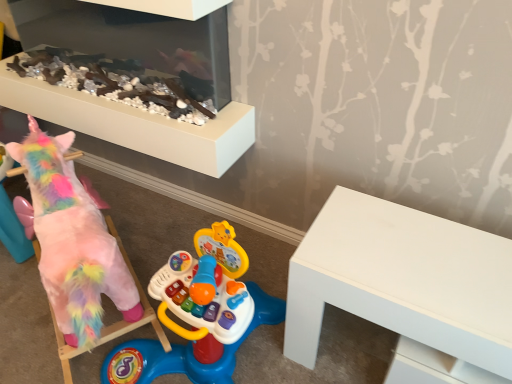
Question: Are smooth white fireplace at upper center and fluffy pink unicorn at left making contact?

Choices:
 (A) yes
 (B) no

Answer: (B)

Question: From a real-world perspective, is smooth white fireplace at upper center positioned under fluffy pink unicorn at left based on gravity?

Choices:
 (A) no
 (B) yes

Answer: (A)

Question: Does smooth white fireplace at upper center come behind fluffy pink unicorn at left?

Choices:
 (A) no
 (B) yes

Answer: (B)

Question: From the image's perspective, is smooth white fireplace at upper center beneath fluffy pink unicorn at left?

Choices:
 (A) no
 (B) yes

Answer: (A)

Question: From the image's perspective, is smooth white fireplace at upper center above fluffy pink unicorn at left?

Choices:
 (A) no
 (B) yes

Answer: (B)

Question: Based on their positions, is fluffy pink unicorn at left located to the left or right of white matte table at right?

Choices:
 (A) left
 (B) right

Answer: (A)

Question: Is point (55, 251) positioned closer to the camera than point (315, 319)?

Choices:
 (A) closer
 (B) farther

Answer: (A)

Question: Considering the positions of fluffy pink unicorn at left and white matte table at right in the image, is fluffy pink unicorn at left taller or shorter than white matte table at right?

Choices:
 (A) tall
 (B) short

Answer: (A)

Question: Do you think fluffy pink unicorn at left is within white matte table at right, or outside of it?

Choices:
 (A) outside
 (B) inside

Answer: (A)

Question: Considering the positions of white matte table at right and fluffy pink unicorn at left in the image, is white matte table at right bigger or smaller than fluffy pink unicorn at left?

Choices:
 (A) small
 (B) big

Answer: (A)

Question: Does point (466, 235) appear closer or farther from the camera than point (55, 203)?

Choices:
 (A) farther
 (B) closer

Answer: (B)

Question: Is white matte table at right wider or thinner than fluffy pink unicorn at left?

Choices:
 (A) wide
 (B) thin

Answer: (A)

Question: Considering the positions of white matte table at right and fluffy pink unicorn at left in the image, is white matte table at right taller or shorter than fluffy pink unicorn at left?

Choices:
 (A) tall
 (B) short

Answer: (B)

Question: In terms of width, does white matte table at right look wider or thinner when compared to smooth white fireplace at upper center?

Choices:
 (A) thin
 (B) wide

Answer: (B)

Question: Do you think white matte table at right is within smooth white fireplace at upper center, or outside of it?

Choices:
 (A) outside
 (B) inside

Answer: (A)